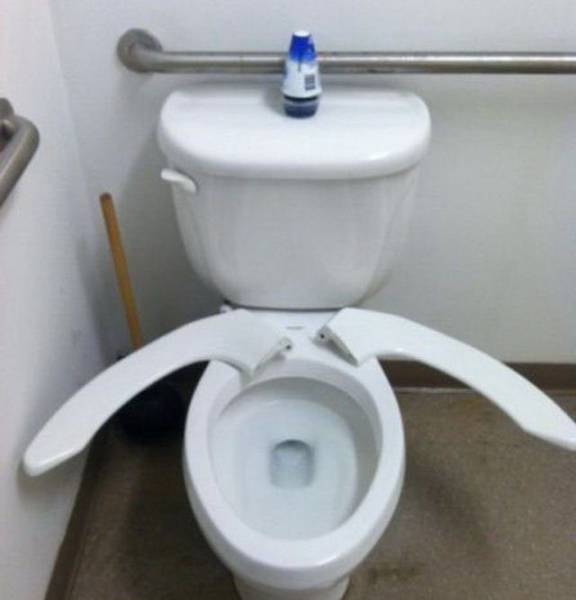
Locate an element on the screen. toilet tank is located at coordinates (299, 242).